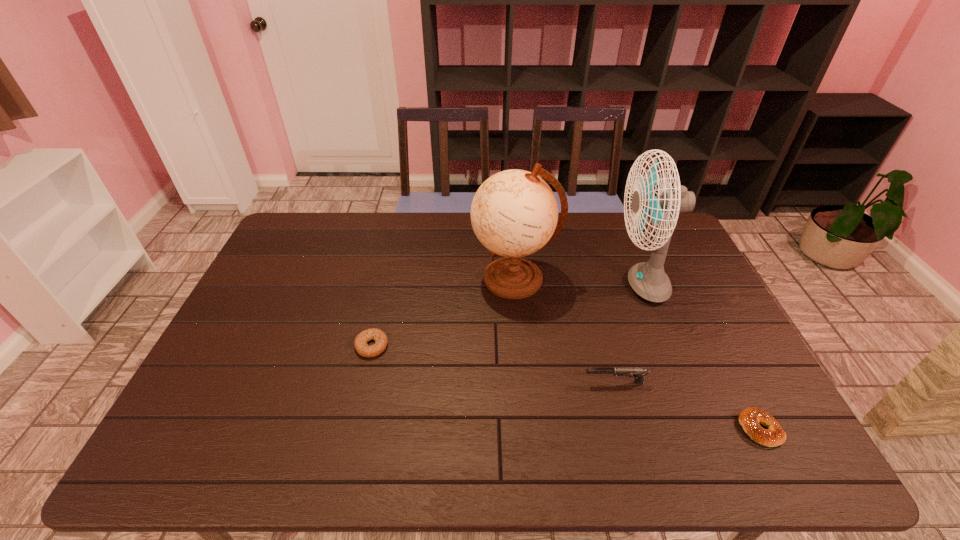
Locate an element on the screen. vacant space that's between the fan and the globe is located at coordinates (578, 281).

Locate an element on the screen. vacant area that lies between the gun and the right bagel is located at coordinates (687, 406).

Locate an element on the screen. The image size is (960, 540). vacant area between the globe and the fan is located at coordinates (578, 281).

You are a GUI agent. You are given a task and a screenshot of the screen. Output one action in this format:
    pyautogui.click(x=<x>, y=<y>)
    Task: Click on the free spot between the fourth object from right to left and the nearer bagel
    The image size is (960, 540).
    Given the screenshot: What is the action you would take?
    pyautogui.click(x=637, y=354)

This screenshot has height=540, width=960. I want to click on free space that is in between the nearest object and the fan, so click(701, 356).

At what (x,y) coordinates should I click in order to perform the action: click on free point between the fan and the nearer bagel. Please return your answer as a coordinate pair (x, y). Looking at the image, I should click on (701, 356).

This screenshot has height=540, width=960. In order to click on vacant space that's between the fan and the fourth object from right to left in this screenshot , I will do `click(578, 281)`.

What are the coordinates of `vacant space in between the fan and the second nearest object` in the screenshot? It's located at (628, 334).

Where is `empty space that is in between the farther bagel and the nearest object`? This screenshot has height=540, width=960. empty space that is in between the farther bagel and the nearest object is located at coordinates (565, 387).

The height and width of the screenshot is (540, 960). What are the coordinates of `free point between the nearest object and the third farthest object` in the screenshot? It's located at (565, 387).